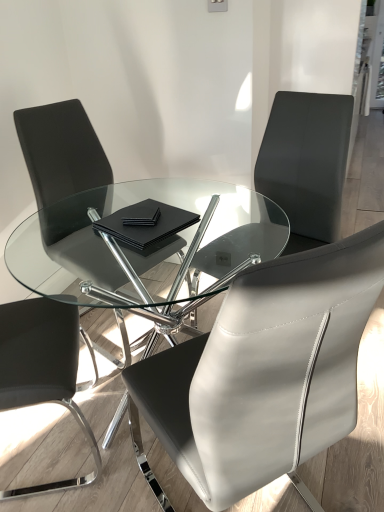
Question: From a real-world perspective, is black leather chair at left, the fourth chair positioned from the right, below black leather chair at upper right, marked as the 1th chair in a right-to-left arrangement?

Choices:
 (A) no
 (B) yes

Answer: (B)

Question: Considering the relative sizes of black leather chair at left, the fourth chair positioned from the right, and black leather chair at upper right, the fourth chair viewed from the left, in the image provided, is black leather chair at left, the fourth chair positioned from the right, thinner than black leather chair at upper right, the fourth chair viewed from the left,?

Choices:
 (A) yes
 (B) no

Answer: (A)

Question: Is black leather chair at left, the fourth chair positioned from the right, wider than black leather chair at upper right, marked as the 1th chair in a right-to-left arrangement?

Choices:
 (A) no
 (B) yes

Answer: (A)

Question: Does black leather chair at left, the fourth chair positioned from the right, have a larger size compared to black leather chair at upper right, marked as the 1th chair in a right-to-left arrangement?

Choices:
 (A) yes
 (B) no

Answer: (B)

Question: Does black leather chair at left, the fourth chair positioned from the right, lie behind black leather chair at upper right, the fourth chair viewed from the left?

Choices:
 (A) no
 (B) yes

Answer: (A)

Question: From the image's perspective, is black leather chair at center, placed as the 2th chair when sorted from right to left, located above or below transparent glass table at center?

Choices:
 (A) below
 (B) above

Answer: (A)

Question: Considering the positions of black leather chair at center, placed as the 2th chair when sorted from right to left, and transparent glass table at center in the image, is black leather chair at center, placed as the 2th chair when sorted from right to left, bigger or smaller than transparent glass table at center?

Choices:
 (A) small
 (B) big

Answer: (A)

Question: Would you say black leather chair at center, placed as the 2th chair when sorted from right to left, is to the left or to the right of transparent glass table at center in the picture?

Choices:
 (A) right
 (B) left

Answer: (A)

Question: Is black leather chair at center, placed as the 2th chair when sorted from right to left, wider or thinner than transparent glass table at center?

Choices:
 (A) thin
 (B) wide

Answer: (A)

Question: Considering the positions of point (109, 231) and point (56, 381), is point (109, 231) closer or farther from the camera than point (56, 381)?

Choices:
 (A) closer
 (B) farther

Answer: (B)

Question: Looking at the image, does black matte notebook at center seem bigger or smaller compared to black leather chair at left, the 1th chair positioned from the left?

Choices:
 (A) big
 (B) small

Answer: (B)

Question: From the image's perspective, is black matte notebook at center positioned above or below black leather chair at left, the 1th chair positioned from the left?

Choices:
 (A) above
 (B) below

Answer: (A)

Question: Which is correct: black matte notebook at center is inside black leather chair at left, the 1th chair positioned from the left, or outside of it?

Choices:
 (A) inside
 (B) outside

Answer: (B)

Question: From a real-world perspective, relative to black matte notebook at center, is transparent glass table at center vertically above or below?

Choices:
 (A) above
 (B) below

Answer: (B)

Question: Does point (175, 313) appear closer or farther from the camera than point (137, 218)?

Choices:
 (A) closer
 (B) farther

Answer: (B)